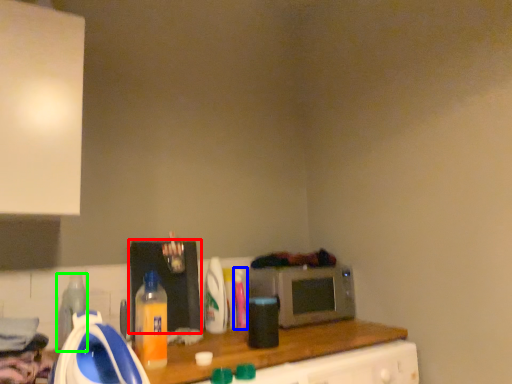
Question: Estimate the real-world distances between objects in this image. Which object is farther from appliance (highlighted by a red box), bottle (highlighted by a blue box) or bottle (highlighted by a green box)?

Choices:
 (A) bottle
 (B) bottle

Answer: (B)